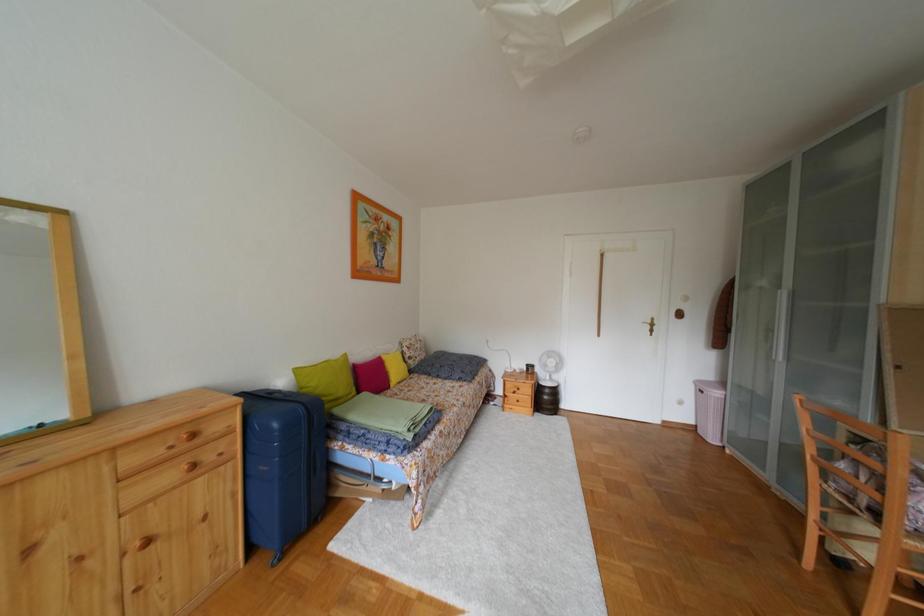
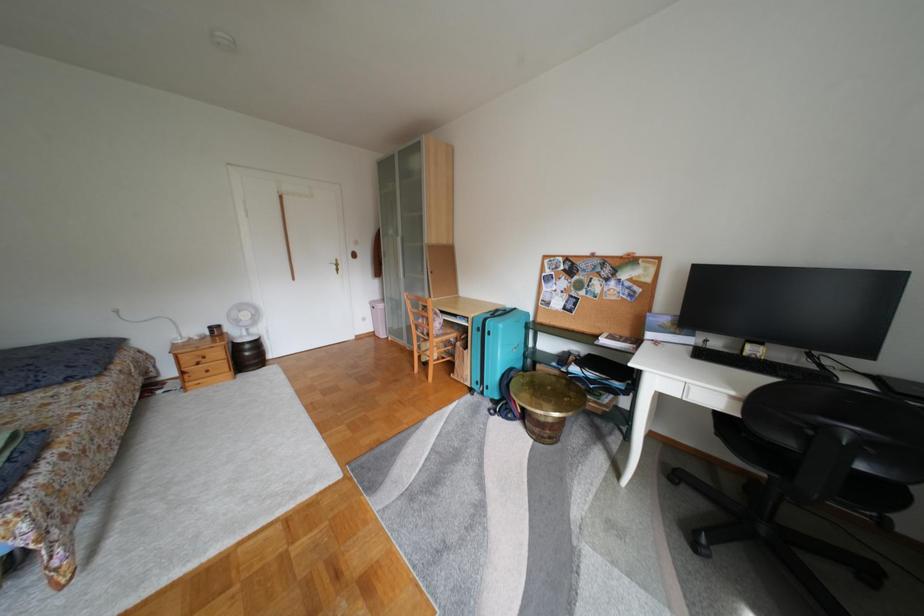
Question: The images are taken continuously from a first-person perspective. In which direction is your viewpoint rotating?

Choices:
 (A) Left
 (B) Right
 (C) Up
 (D) Down

Answer: (B)